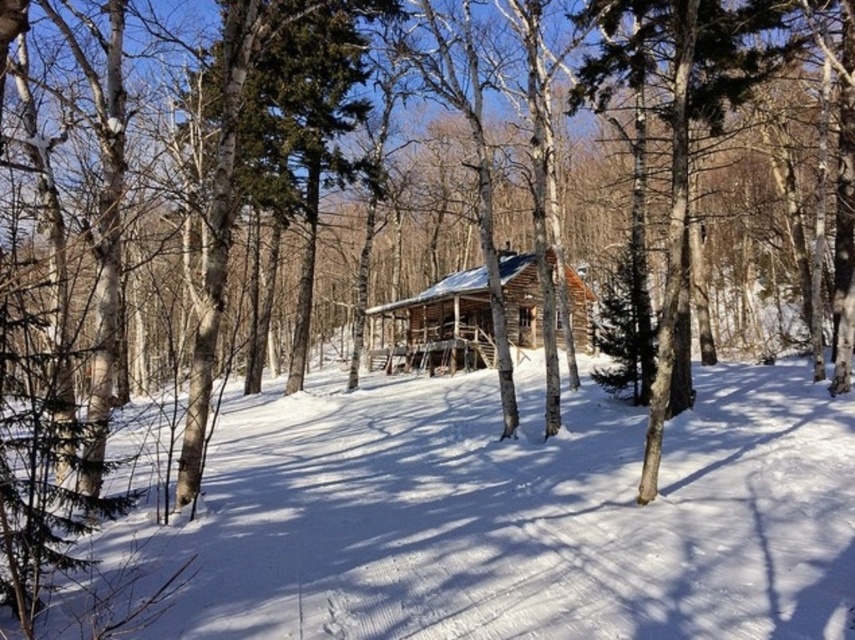
Based on the photo, you are a visitor planning to build a snowman using the white powdery snow at center near the wooden log cabin at center. Considering the height of the snow, will there be enough snow to make a snowman that is taller than the cabin?

The white powdery snow at center has a greater height compared to wooden log cabin at center. Therefore, there is enough snow to make a snowman taller than the cabin.

You are standing at the entrance of the cabin and want to walk towards the white powdery snow at center. Which direction should you head?

The white powdery snow at center is located at point (517, 516), so you should head towards the center of the image to reach it.